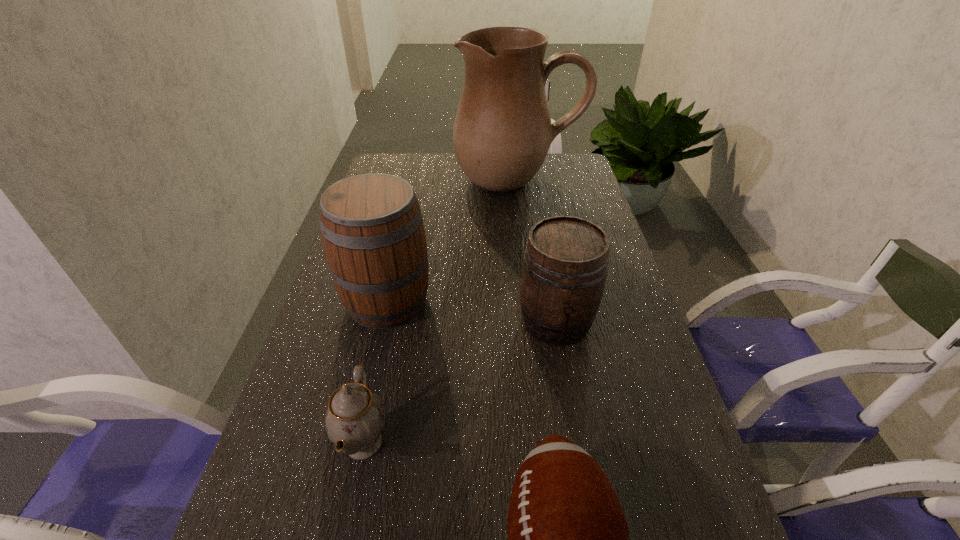
At what (x,y) coordinates should I click in order to perform the action: click on the farthest object. Please return your answer as a coordinate pair (x, y). This screenshot has height=540, width=960. Looking at the image, I should click on (502, 132).

I want to click on cream pitcher, so click(502, 132).

This screenshot has width=960, height=540. In order to click on the taller cider in this screenshot , I will do `click(372, 230)`.

Where is `the second tallest object`? The image size is (960, 540). the second tallest object is located at coordinates (372, 230).

The image size is (960, 540). Find the location of `the right cider`. the right cider is located at coordinates (565, 264).

Where is `the third shortest object`? This screenshot has height=540, width=960. the third shortest object is located at coordinates (565, 264).

Image resolution: width=960 pixels, height=540 pixels. What are the coordinates of `chinaware` in the screenshot? It's located at (355, 418).

What are the coordinates of `vacant space located 0.140m at the spout of the cream pitcher` in the screenshot? It's located at (523, 227).

Where is `free space located on the right of the taller cider`? Image resolution: width=960 pixels, height=540 pixels. free space located on the right of the taller cider is located at coordinates (504, 301).

Where is `vacant space located 0.300m on the side of the third tallest object near the bung hole`? The width and height of the screenshot is (960, 540). vacant space located 0.300m on the side of the third tallest object near the bung hole is located at coordinates (584, 481).